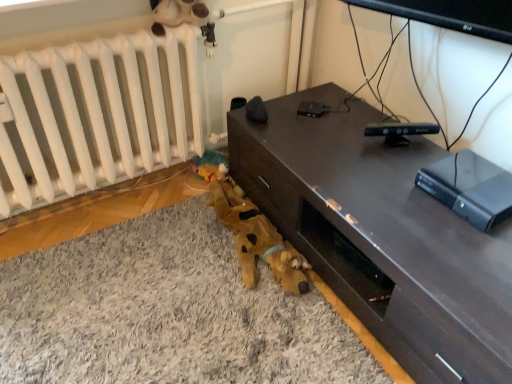
At what (x,y) coordinates should I click in order to perform the action: click on vacant space in front of black plastic remote control at upper center, arranged as the 2th gadget when viewed from the left. Please return your answer as a coordinate pair (x, y). This screenshot has height=384, width=512. Looking at the image, I should click on (401, 163).